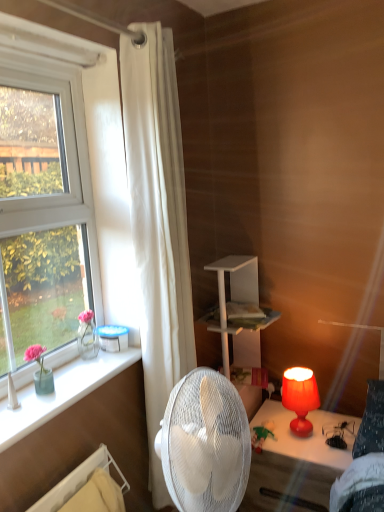
Question: Considering the relative sizes of plush green bear at lower center and clear glass vase at left in the image provided, is plush green bear at lower center shorter than clear glass vase at left?

Choices:
 (A) no
 (B) yes

Answer: (A)

Question: Is plush green bear at lower center wider than clear glass vase at left?

Choices:
 (A) yes
 (B) no

Answer: (A)

Question: Can you confirm if plush green bear at lower center is taller than clear glass vase at left?

Choices:
 (A) yes
 (B) no

Answer: (A)

Question: Is plush green bear at lower center bigger than clear glass vase at left?

Choices:
 (A) no
 (B) yes

Answer: (A)

Question: Considering the relative sizes of plush green bear at lower center and clear glass vase at left in the image provided, is plush green bear at lower center thinner than clear glass vase at left?

Choices:
 (A) yes
 (B) no

Answer: (B)

Question: Is plush green bear at lower center beside clear glass vase at left?

Choices:
 (A) no
 (B) yes

Answer: (A)

Question: From the image's perspective, is white fabric curtain at left on clear glass vase at left?

Choices:
 (A) no
 (B) yes

Answer: (B)

Question: Are white fabric curtain at left and clear glass vase at left located far from each other?

Choices:
 (A) yes
 (B) no

Answer: (B)

Question: Considering the relative positions of white fabric curtain at left and clear glass vase at left in the image provided, is white fabric curtain at left behind clear glass vase at left?

Choices:
 (A) no
 (B) yes

Answer: (B)

Question: Can you confirm if white fabric curtain at left is thinner than clear glass vase at left?

Choices:
 (A) no
 (B) yes

Answer: (B)

Question: Is clear glass vase at left surrounded by white fabric curtain at left?

Choices:
 (A) no
 (B) yes

Answer: (A)

Question: From a real-world perspective, is white fabric curtain at left positioned over clear glass vase at left based on gravity?

Choices:
 (A) yes
 (B) no

Answer: (A)

Question: Is the depth of white fabric curtain at left greater than that of plush green bear at lower center?

Choices:
 (A) yes
 (B) no

Answer: (B)